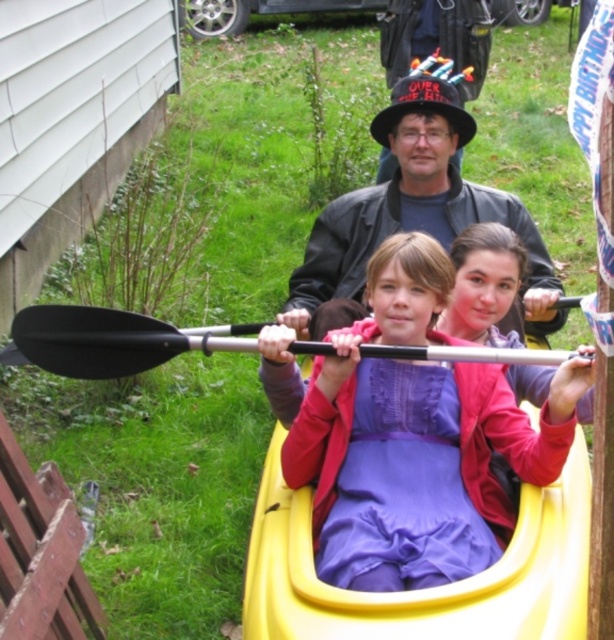
Who is taller, yellow plastic canoe at center or matte black jacket at center?

Standing taller between the two is matte black jacket at center.

Does point (313, 634) come in front of point (383, 120)?

Yes, it is in front of point (383, 120).

Locate an element on the screen. Image resolution: width=614 pixels, height=640 pixels. yellow plastic canoe at center is located at coordinates (424, 588).

Is matte black jacket at center shorter than black rubber paddle at center?

Incorrect, matte black jacket at center's height does not fall short of black rubber paddle at center's.

Does matte black jacket at center appear on the left side of black rubber paddle at center?

In fact, matte black jacket at center is to the right of black rubber paddle at center.

Identify the location of matte black jacket at center. This screenshot has height=640, width=614. (414, 209).

Is purple fabric dress at center wider than matte black jacket at center?

No.

Does purple fabric dress at center appear on the left side of matte black jacket at center?

In fact, purple fabric dress at center is to the right of matte black jacket at center.

Who is more distant from viewer, (410, 422) or (311, 250)?

The point (311, 250) is more distant.

Identify the location of purple fabric dress at center. (413, 449).